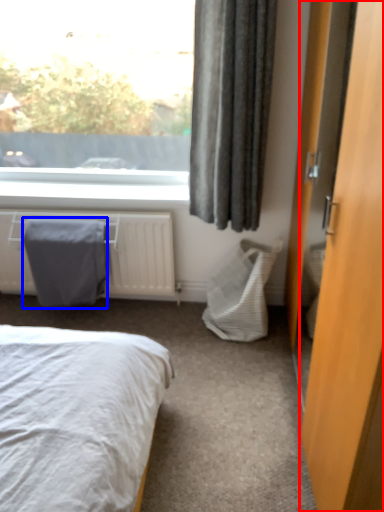
Question: Which object is further to the camera taking this photo, door (highlighted by a red box) or blanket (highlighted by a blue box)?

Choices:
 (A) door
 (B) blanket

Answer: (B)